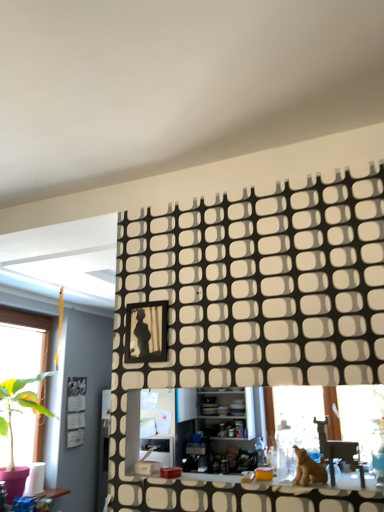
The height and width of the screenshot is (512, 384). Identify the location of blank space situated above white glossy counter top at center (from a real-world perspective). (253, 482).